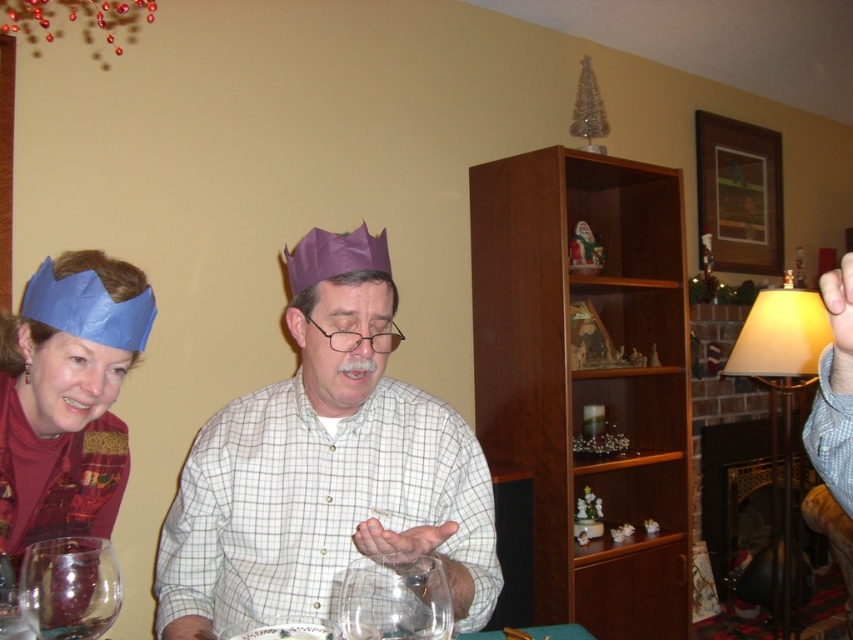
You are standing in the room and want to move from the point at coordinates point (7, 404) to the point at coordinates point (38, 561). Can you walk directly between these two points without any obstacles?

Point (7, 404) is behind point (38, 561), so you cannot walk directly between them without going around the obstacle in front of point (7, 404).

You are a guest at this holiday party and want to place your blue paper crown at left on the table without it touching the transparent glass wine glass at lower left. Given their sizes, is this possible?

The blue paper crown at left is much taller than the transparent glass wine glass at lower left, so it can be placed on the table without touching the glass if positioned appropriately.